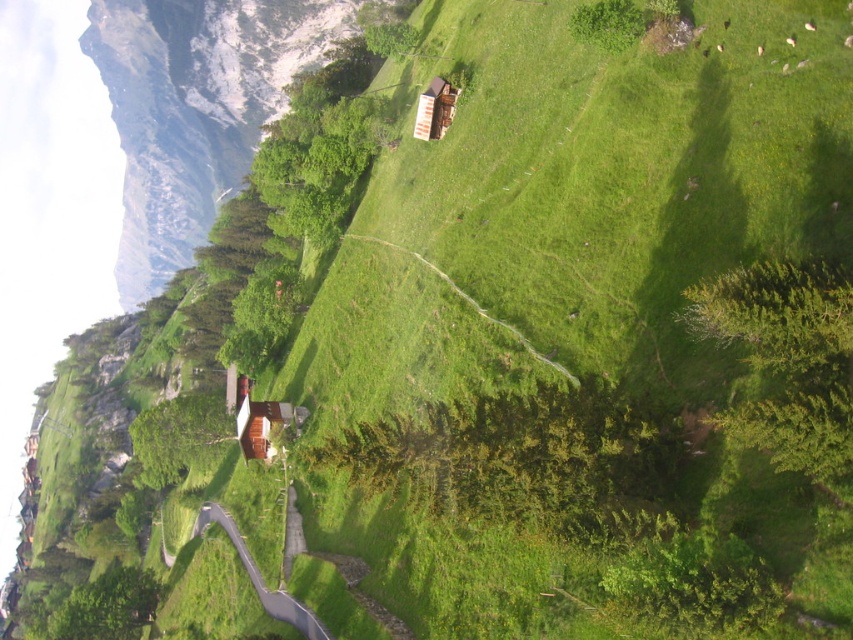
Question: Which of the following is the farthest from the observer?

Choices:
 (A) (318, 628)
 (B) (148, 186)
 (C) (263, 451)

Answer: (B)

Question: Can you confirm if brown wooden cabin at center is positioned to the left of wooden cabin at center?

Choices:
 (A) no
 (B) yes

Answer: (B)

Question: Is dark gray asphalt path at lower center in front of brown wooden cabin at center?

Choices:
 (A) no
 (B) yes

Answer: (B)

Question: Which point appears farthest from the camera in this image?

Choices:
 (A) (293, 417)
 (B) (288, 616)

Answer: (A)

Question: Is dark gray asphalt path at lower center positioned before wooden cabin at center?

Choices:
 (A) no
 (B) yes

Answer: (B)

Question: Which object is farther from the camera taking this photo?

Choices:
 (A) brown wooden cabin at center
 (B) snowy rocky mountain at upper left

Answer: (B)